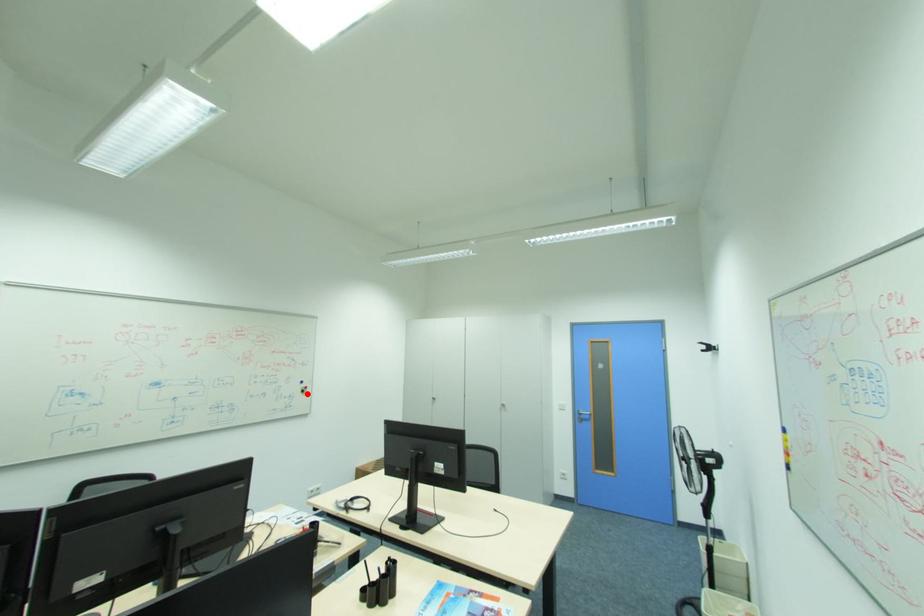
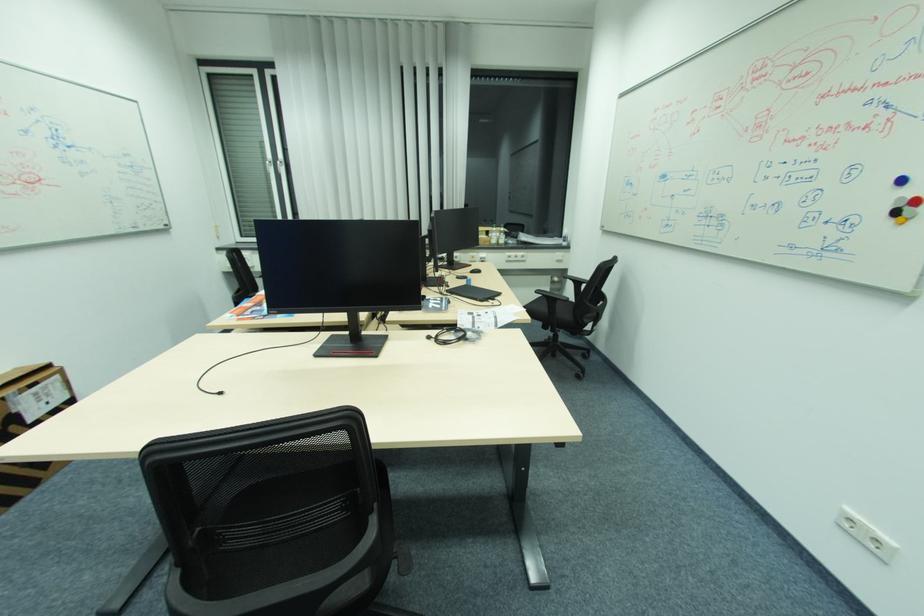
Where in the second image is the point corresponding to the highlighted location from the first image?

(896, 221)